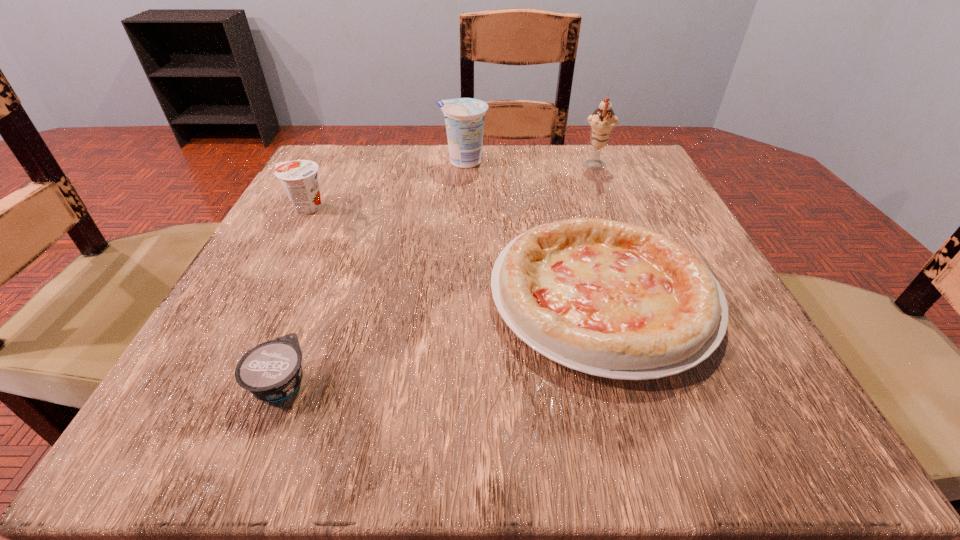
Where is `object that is positioned at the far right corner`? object that is positioned at the far right corner is located at coordinates (602, 122).

Where is `object that is at the near right corner`? Image resolution: width=960 pixels, height=540 pixels. object that is at the near right corner is located at coordinates (611, 299).

Find the location of `vacant region at the far edge`. vacant region at the far edge is located at coordinates (415, 182).

Locate an element on the screen. free space at the near edge of the desktop is located at coordinates [433, 411].

Where is `free region at the left edge`? free region at the left edge is located at coordinates (323, 213).

This screenshot has height=540, width=960. What are the coordinates of `vacant region at the right edge of the desktop` in the screenshot? It's located at (696, 241).

Identify the location of free space at the far right corner of the desktop. This screenshot has height=540, width=960. (641, 160).

Identify the location of free point at the near right corner. (795, 444).

Identify the location of vacant area between the tallest yogurt and the third farthest object. (385, 185).

Find the location of a particular element. free space between the second tallest object and the second tallest yogurt is located at coordinates (385, 185).